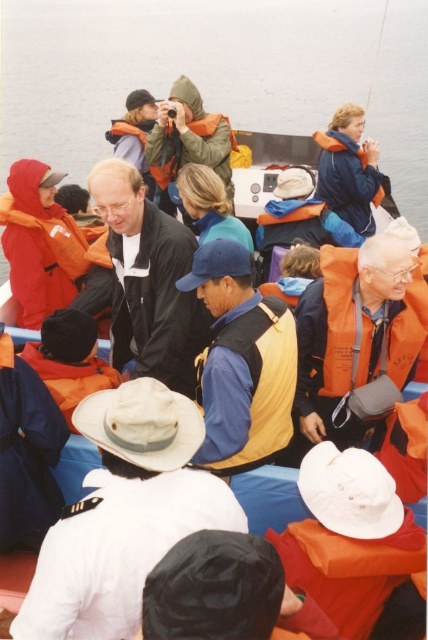
Is matte black jacket at center above orange life jacket at center?

No, matte black jacket at center is not above orange life jacket at center.

Between matte black jacket at center and orange life jacket at center, which one appears on the right side from the viewer's perspective?

orange life jacket at center is more to the right.

Is point (131, 333) positioned in front of point (189, 150)?

Yes, it is in front of point (189, 150).

The image size is (428, 640). I want to click on matte black jacket at center, so click(x=148, y=280).

Measure the distance between orange/yellow fabric life jacket at lower center and camera.

orange/yellow fabric life jacket at lower center and camera are 3.77 meters apart from each other.

Which is in front, point (353, 545) or point (391, 451)?

Point (353, 545) is more forward.

Is point (398, 564) positioned in front of point (422, 458)?

Yes.

Identify the location of orange/yellow fabric life jacket at lower center. (348, 570).

Consider the image. Can you confirm if orange fleece life jacket at left is positioned to the right of orange fabric life jacket at right?

No, orange fleece life jacket at left is not to the right of orange fabric life jacket at right.

Does orange fleece life jacket at left have a larger size compared to orange fabric life jacket at right?

Yes.

Between point (15, 220) and point (415, 296), which one is positioned in front?

Point (415, 296) is in front.

Image resolution: width=428 pixels, height=640 pixels. I want to click on orange fleece life jacket at left, so click(x=41, y=260).